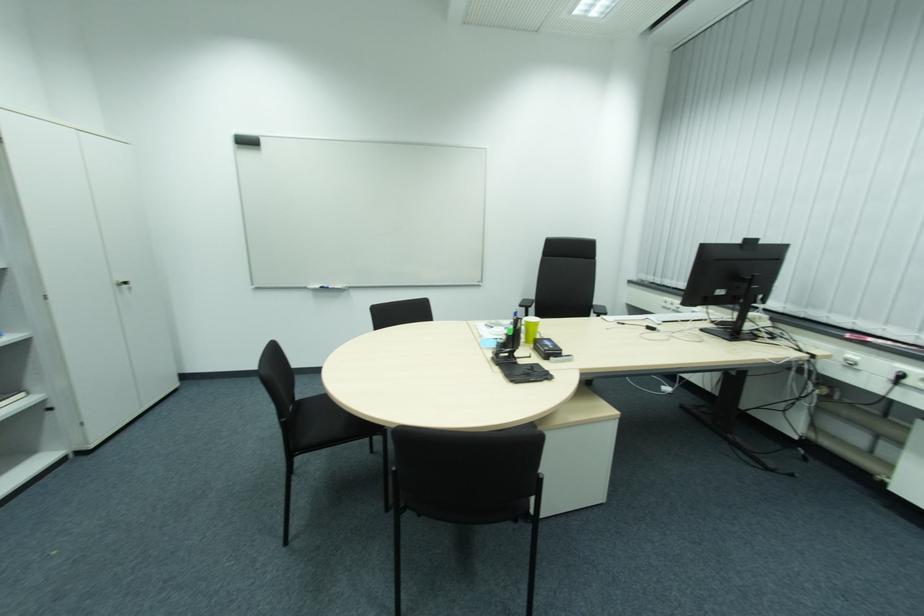
Find the location of a particular element. The width and height of the screenshot is (924, 616). chair sitting surface is located at coordinates (314, 422).